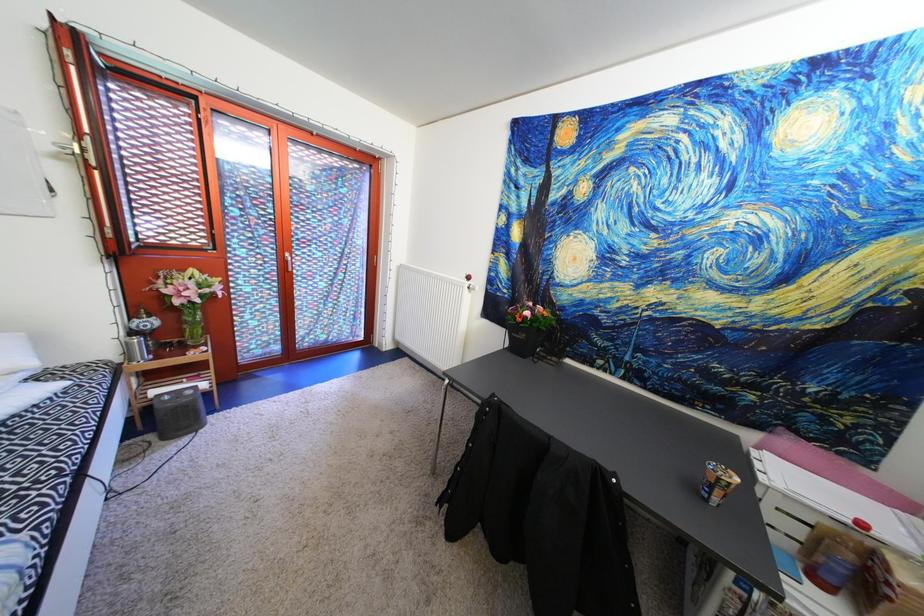
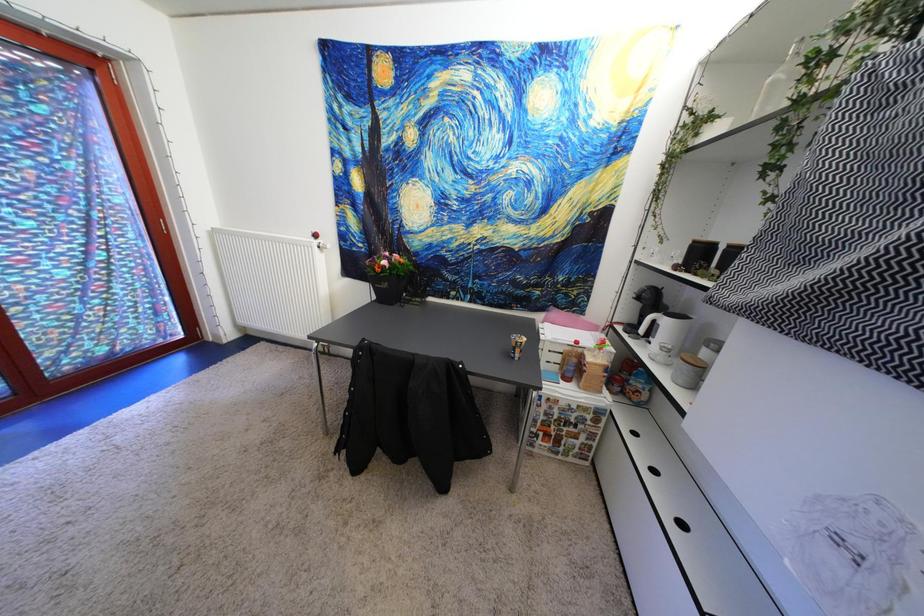
Question: Based on the continuous images, in which direction is the camera rotating? Reply with the corresponding letter.

Choices:
 (A) Left
 (B) Right
 (C) Up
 (D) Down

Answer: (B)